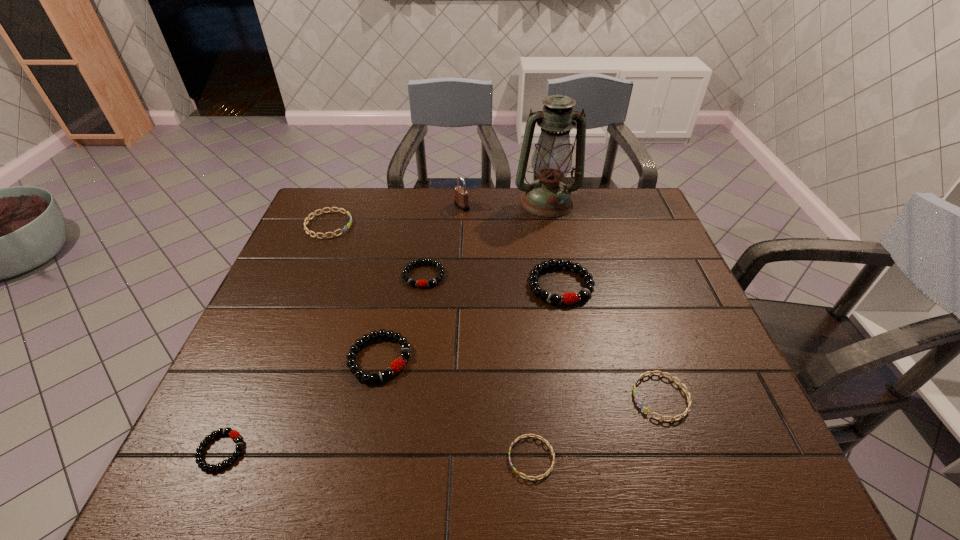
What are the coordinates of `the tallest object` in the screenshot? It's located at (548, 197).

Identify the location of the eighth shortest object. The width and height of the screenshot is (960, 540). (461, 195).

Locate an element on the screen. padlock is located at coordinates (461, 195).

Find the location of a particular element. This screenshot has height=540, width=960. the biggest black bracelet is located at coordinates (569, 298).

I want to click on the rightmost black bracelet, so [x=569, y=298].

You are a GUI agent. You are given a task and a screenshot of the screen. Output one action in this format:
    pyautogui.click(x=<x>, y=<y>)
    Task: Click on the third smallest black bracelet
    The image size is (960, 540).
    Given the screenshot: What is the action you would take?
    pyautogui.click(x=397, y=365)

Find the location of a particular element. Image resolution: width=960 pixels, height=540 pixels. the leftmost blue bracelet is located at coordinates (345, 228).

Identify the location of the farthest blue bracelet. (345, 228).

You are a GUI agent. You are given a task and a screenshot of the screen. Output one action in this format:
    pyautogui.click(x=<x>, y=<y>)
    Task: Click on the third biggest black bracelet
    
    Given the screenshot: What is the action you would take?
    pyautogui.click(x=420, y=283)

The image size is (960, 540). Identify the location of the rightmost bracelet. (646, 410).